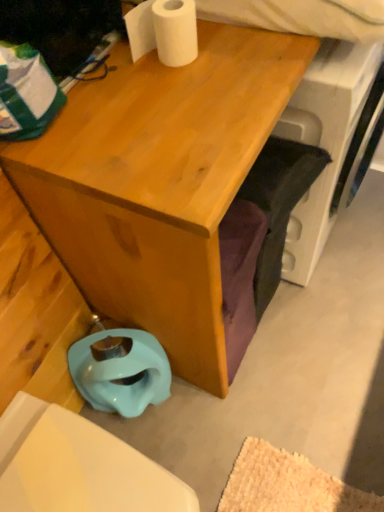
Question: Is light blue rubber toilet bowl at lower left bigger or smaller than matte wood desk at center?

Choices:
 (A) small
 (B) big

Answer: (A)

Question: From the image's perspective, relative to matte wood desk at center, is light blue rubber toilet bowl at lower left above or below?

Choices:
 (A) above
 (B) below

Answer: (B)

Question: Which object is positioned farthest from the white matte toilet paper at upper center?

Choices:
 (A) light blue rubber toilet bowl at lower left
 (B) matte wood desk at center

Answer: (A)

Question: Which object is positioned closest to the light blue rubber toilet bowl at lower left?

Choices:
 (A) white matte toilet paper at upper center
 (B) matte wood desk at center

Answer: (B)